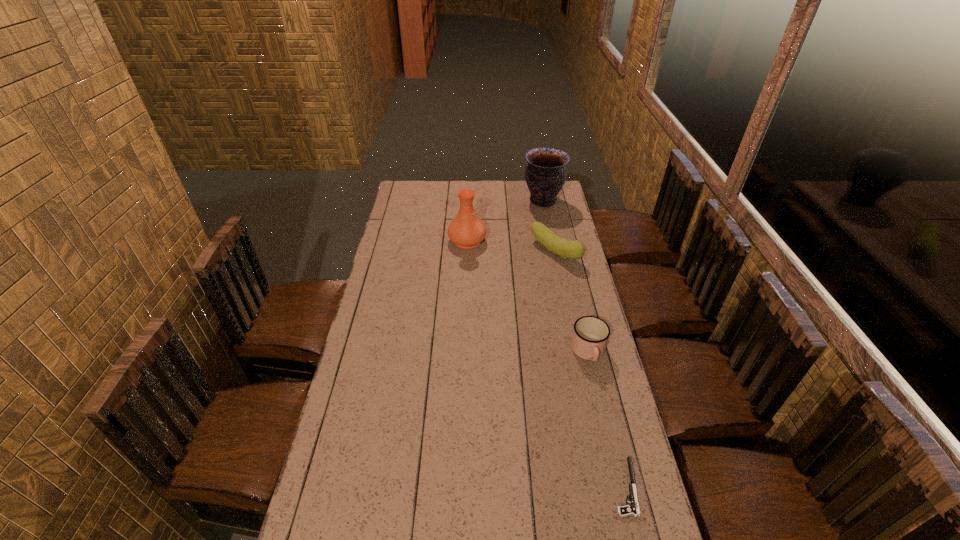
This screenshot has height=540, width=960. Find the location of `object that is at the far right corner`. object that is at the far right corner is located at coordinates (545, 174).

The width and height of the screenshot is (960, 540). In the image, there is a desktop. In order to click on vacant space at the far edge in this screenshot , I will do `click(476, 186)`.

At what (x,y) coordinates should I click in order to perform the action: click on vacant point at the left edge. Please return your answer as a coordinate pair (x, y). The image size is (960, 540). Looking at the image, I should click on (392, 396).

Identify the location of vacant space at the right edge of the desktop. This screenshot has height=540, width=960. (570, 382).

Find the location of a particular element. The height and width of the screenshot is (540, 960). free space at the far right corner of the desktop is located at coordinates (557, 201).

At what (x,y) coordinates should I click in order to perform the action: click on empty space between the cucumber and the pottery. Please return your answer as a coordinate pair (x, y). Looking at the image, I should click on (549, 226).

You are a GUI agent. You are given a task and a screenshot of the screen. Output one action in this format:
    pyautogui.click(x=<x>, y=<y>)
    Task: Click on the vacant space in between the leftmost object and the shortest object
    The width and height of the screenshot is (960, 540).
    Given the screenshot: What is the action you would take?
    pyautogui.click(x=546, y=364)

Image resolution: width=960 pixels, height=540 pixels. I want to click on free area in between the nearest object and the cucumber, so click(590, 369).

The height and width of the screenshot is (540, 960). I want to click on unoccupied area between the vase and the mug, so click(x=528, y=296).

Locate an element on the screen. Image resolution: width=960 pixels, height=540 pixels. vacant area that lies between the second nearest object and the pistol is located at coordinates (607, 420).